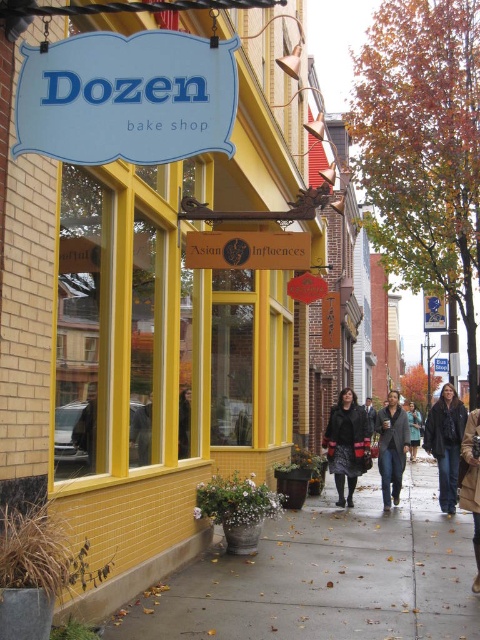
You are a customer standing in front of the Dozen Bake Shop. You notice the yellow brick bake shop sign at upper left and the denim jacket at lower right. Which object is taller?

The yellow brick bake shop sign at upper left is taller than the denim jacket at lower right.

You are a customer entering the bakery and see the dark gray sweater at center and the brown leather jacket at lower right hanging on a rack. Which one is closer to your eye level?

The dark gray sweater at center is shorter than the brown leather jacket at lower right, so the brown leather jacket at lower right is closer to your eye level.